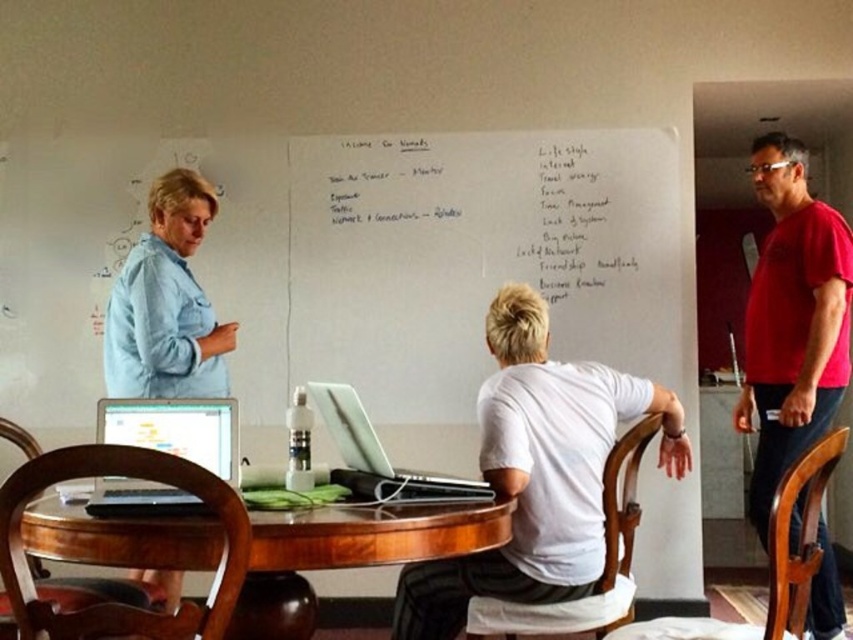
Question: Is white handwritten notes at center further to camera compared to matte black laptop at lower left?

Choices:
 (A) yes
 (B) no

Answer: (A)

Question: Can you confirm if mahogany wood table at center is bigger than white paperboard at upper center?

Choices:
 (A) yes
 (B) no

Answer: (A)

Question: Which object is positioned closest to the silver metallic laptop at center?

Choices:
 (A) white matte shirt at center
 (B) white paperboard at upper center
 (C) matte black laptop at lower left
 (D) mahogany wood table at center

Answer: (D)

Question: Which object appears closest to the camera in this image?

Choices:
 (A) white handwritten notes at center
 (B) matte black laptop at lower left
 (C) mahogany wood table at center
 (D) silver metallic laptop at center

Answer: (C)

Question: Which point is farther to the camera?

Choices:
 (A) (331, 218)
 (B) (132, 416)
 (C) (564, 282)

Answer: (A)

Question: Does white handwritten notes at center have a lesser width compared to silver metallic laptop at center?

Choices:
 (A) yes
 (B) no

Answer: (B)